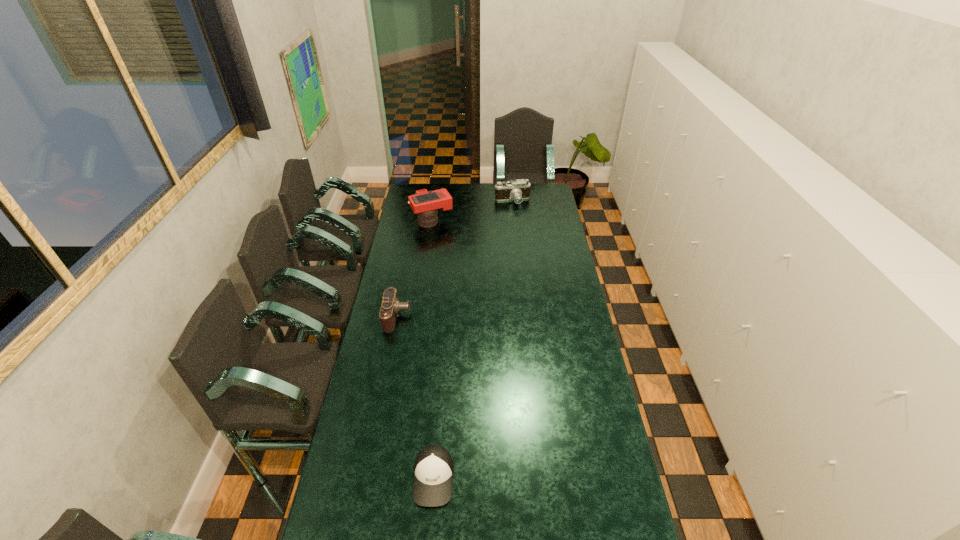
Where is `vacant space that is in between the cap and the nearest camera`? This screenshot has width=960, height=540. vacant space that is in between the cap and the nearest camera is located at coordinates (416, 397).

Find the location of a particular element. Image resolution: width=960 pixels, height=540 pixels. vacant region between the rightmost object and the cap is located at coordinates (473, 339).

Identify the location of vacant point located between the second farthest object and the rightmost object. (472, 211).

Image resolution: width=960 pixels, height=540 pixels. Find the location of `vacant space that's between the second nearest object and the nearest object`. vacant space that's between the second nearest object and the nearest object is located at coordinates (416, 397).

This screenshot has width=960, height=540. I want to click on free space between the shortest camera and the cap, so (416, 397).

At what (x,y) coordinates should I click in order to perform the action: click on vacant point located between the cap and the third nearest object. Please return your answer as a coordinate pair (x, y). The height and width of the screenshot is (540, 960). Looking at the image, I should click on (433, 349).

I want to click on empty location between the rightmost object and the second nearest object, so click(x=455, y=259).

The height and width of the screenshot is (540, 960). I want to click on free space between the tallest object and the rightmost object, so click(x=472, y=211).

Identify which object is the second nearest to the tallest object. Please provide its 2D coordinates. Your answer should be formatted as a tuple, i.e. [(x, y)], where the tuple contains the x and y coordinates of a point satisfying the conditions above.

[(390, 307)]

Find the location of a particular element. The height and width of the screenshot is (540, 960). object that stands as the third closest to the nearest camera is located at coordinates (517, 190).